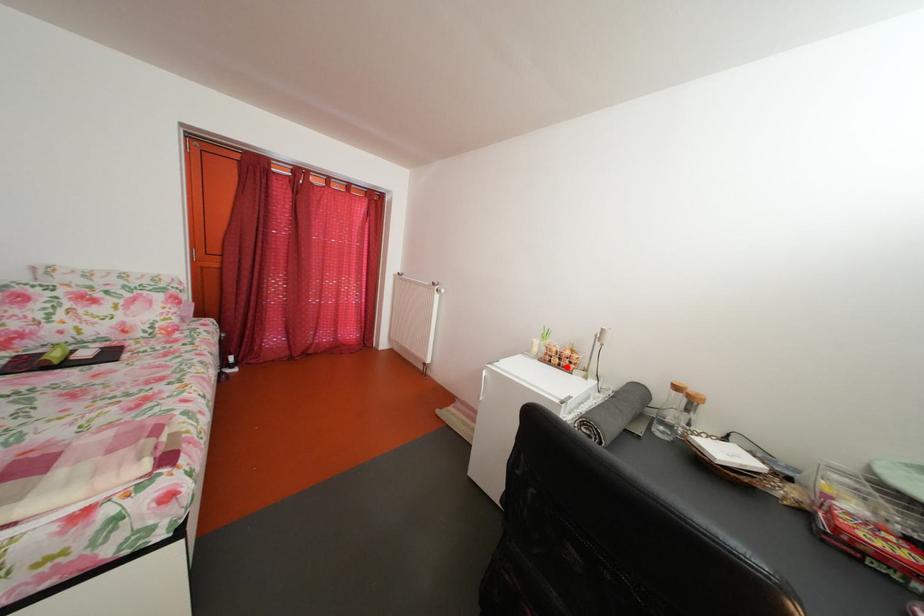
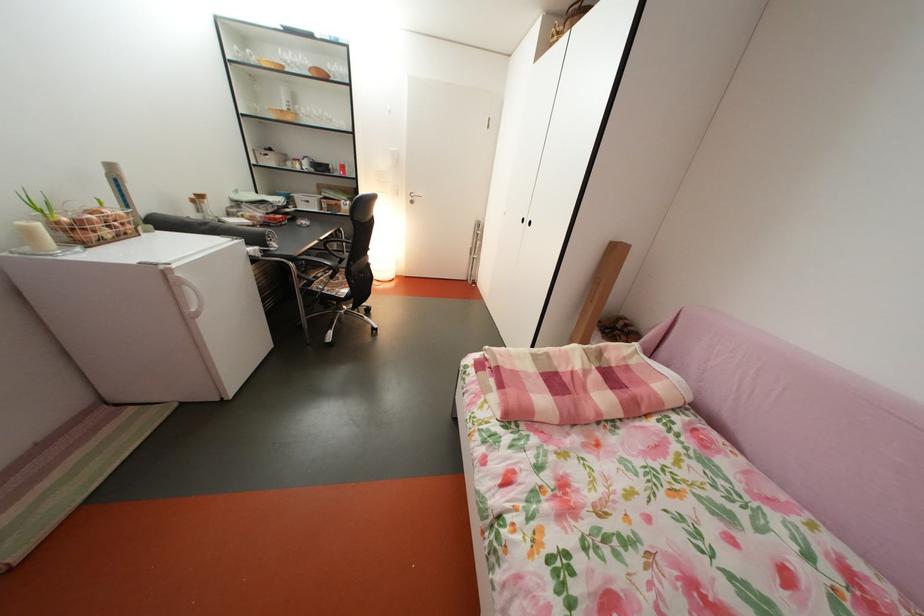
The point at the highlighted location is marked in the first image. Where is the corresponding point in the second image?

(118, 238)